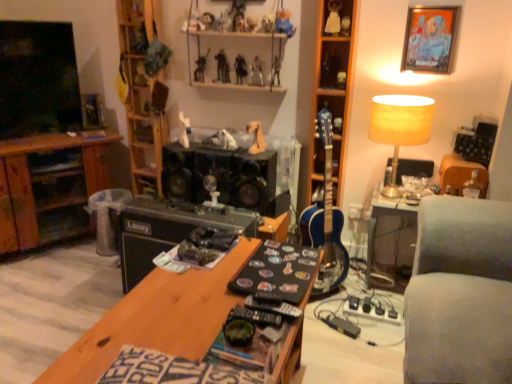
Where is `vacant space that's between white plush dog at center, marked as the 12th toy in a right-to-left arrangement, and orange matte horse at center, arranged as the 9th toy when viewed from the left`? This screenshot has width=512, height=384. vacant space that's between white plush dog at center, marked as the 12th toy in a right-to-left arrangement, and orange matte horse at center, arranged as the 9th toy when viewed from the left is located at coordinates (228, 150).